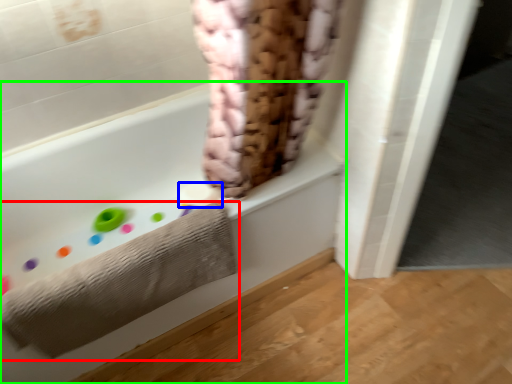
Question: Which is nearer to the towel (highlighted by a red box)? toilet paper (highlighted by a blue box) or bathtub (highlighted by a green box).

Choices:
 (A) toilet paper
 (B) bathtub

Answer: (B)